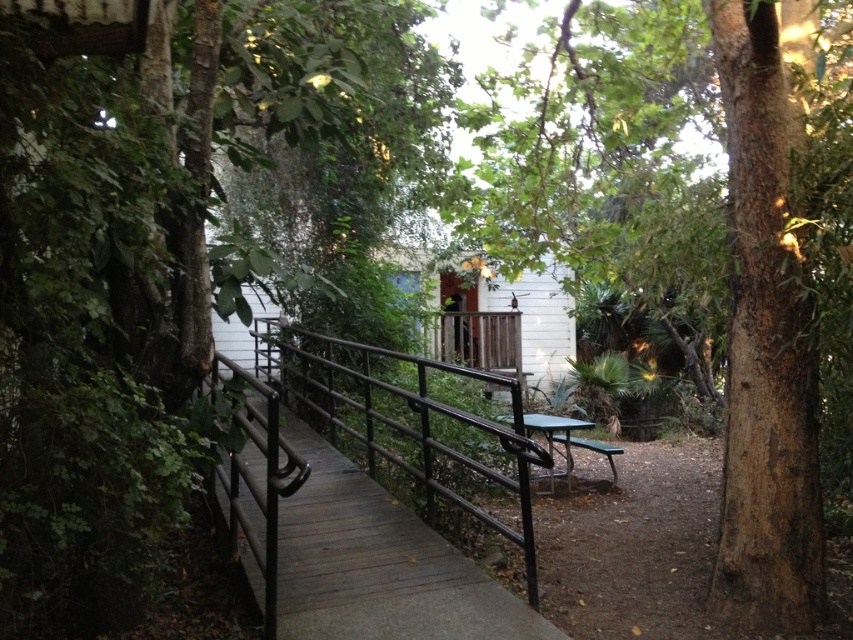
Question: Among these objects, which one is nearest to the camera?

Choices:
 (A) black metal/rail at center
 (B) brown rough tree at center

Answer: (A)

Question: Can you confirm if brown rough tree at center is smaller than black metal/rail at center?

Choices:
 (A) yes
 (B) no

Answer: (A)

Question: Can you confirm if black metal/rail at center is positioned below green plastic picnic table at center?

Choices:
 (A) no
 (B) yes

Answer: (A)

Question: Which point is closer to the camera taking this photo?

Choices:
 (A) (509, 118)
 (B) (141, 502)
 (C) (303, 342)
 (D) (612, 474)

Answer: (B)

Question: Is green leafy tree at center to the right of green plastic picnic table at center from the viewer's perspective?

Choices:
 (A) yes
 (B) no

Answer: (B)

Question: Among these objects, which one is farthest from the camera?

Choices:
 (A) black metal/rail at center
 (B) green plastic picnic table at center

Answer: (A)